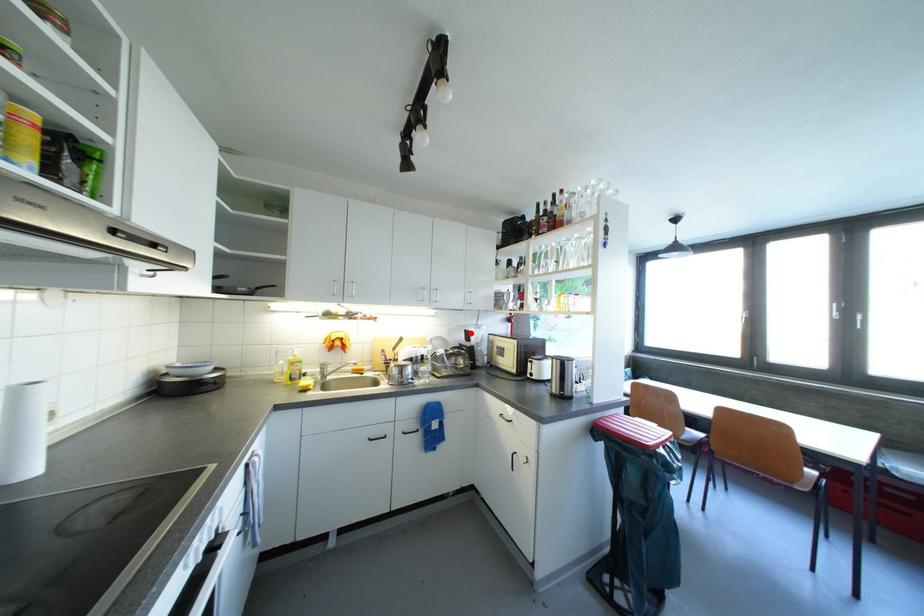
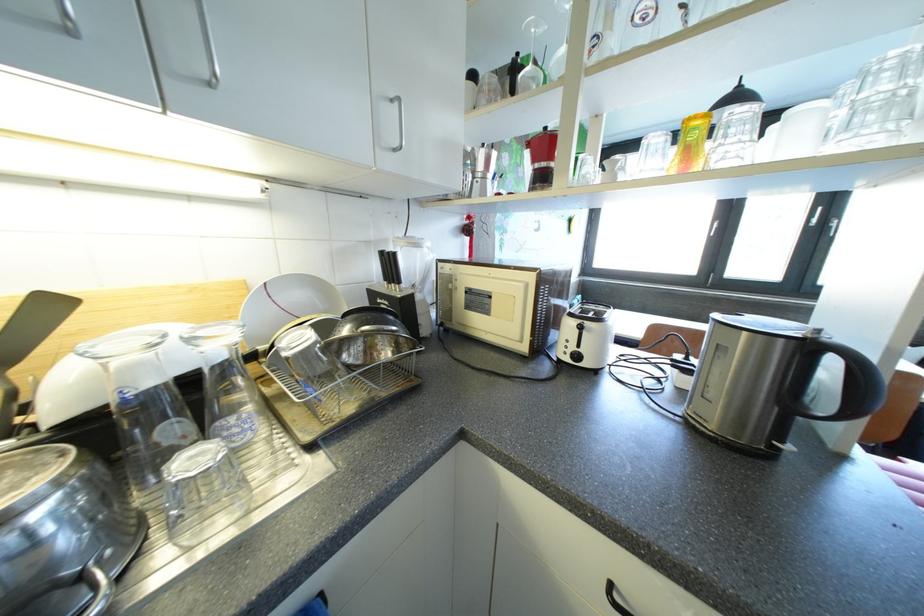
Where in the second image is the point corresponding to the highlighted location from the first image?

(387, 256)